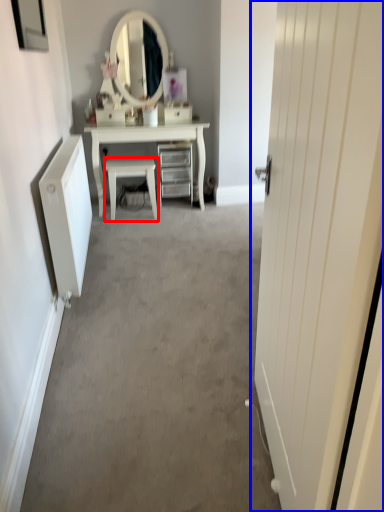
Question: Among these objects, which one is nearest to the camera, chair (highlighted by a red box) or door (highlighted by a blue box)?

Choices:
 (A) chair
 (B) door

Answer: (B)